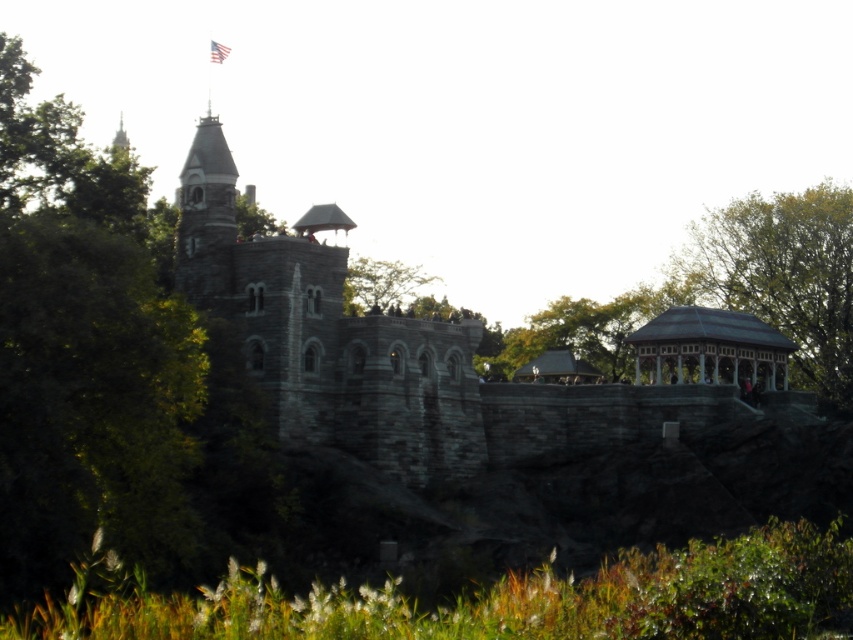
Question: From the image, what is the correct spatial relationship of green leafy tree at upper right in relation to wooden gazebo at right?

Choices:
 (A) above
 (B) below

Answer: (A)

Question: Considering the real-world distances, which object is farthest from the green leafy tree at upper center?

Choices:
 (A) wooden gazebo at right
 (B) green leafy tree at left

Answer: (A)

Question: Can you confirm if wooden gazebo at right is positioned above green leafy tree at upper center?

Choices:
 (A) yes
 (B) no

Answer: (B)

Question: Among these points, which one is farthest from the camera?

Choices:
 (A) (363, 285)
 (B) (734, 310)
 (C) (844, 260)
 (D) (752, 364)

Answer: (A)

Question: Which point is closer to the camera taking this photo?

Choices:
 (A) (76, 433)
 (B) (184, 285)
 (C) (715, 369)
 (D) (219, 216)

Answer: (A)

Question: Does green leafy tree at left appear under white fabric flag at upper center?

Choices:
 (A) yes
 (B) no

Answer: (A)